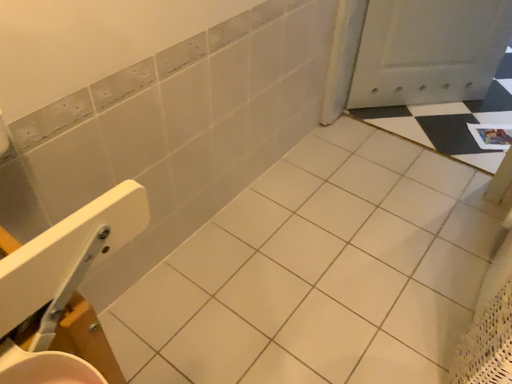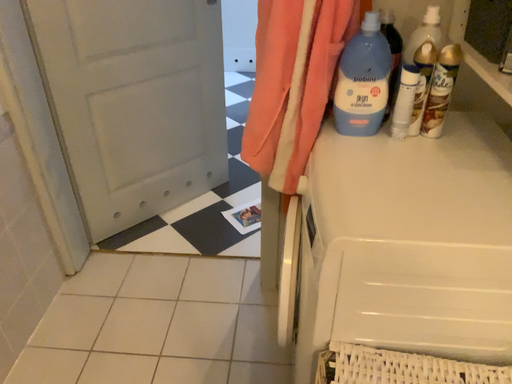
Question: Which way did the camera rotate in the video?

Choices:
 (A) rotated downward
 (B) rotated upward

Answer: (B)